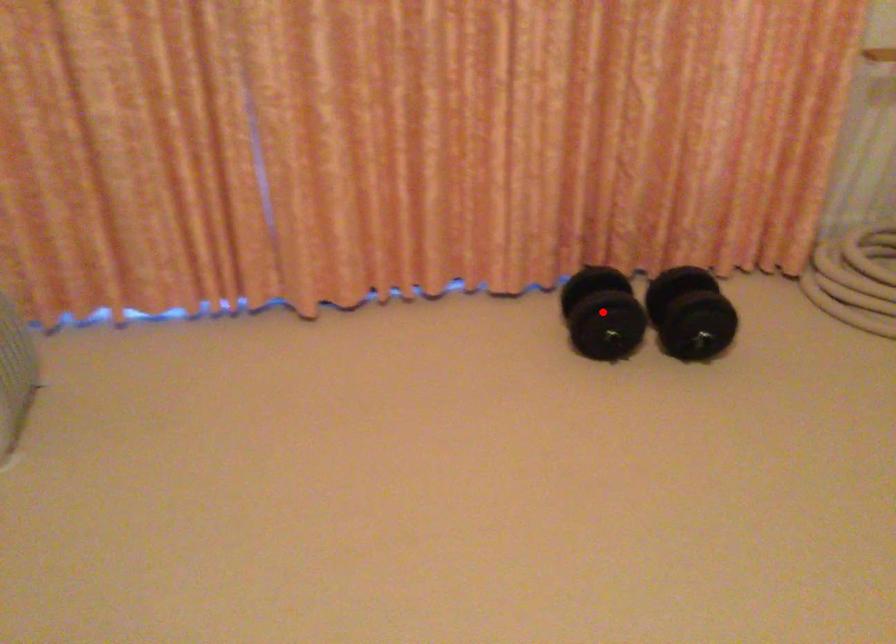
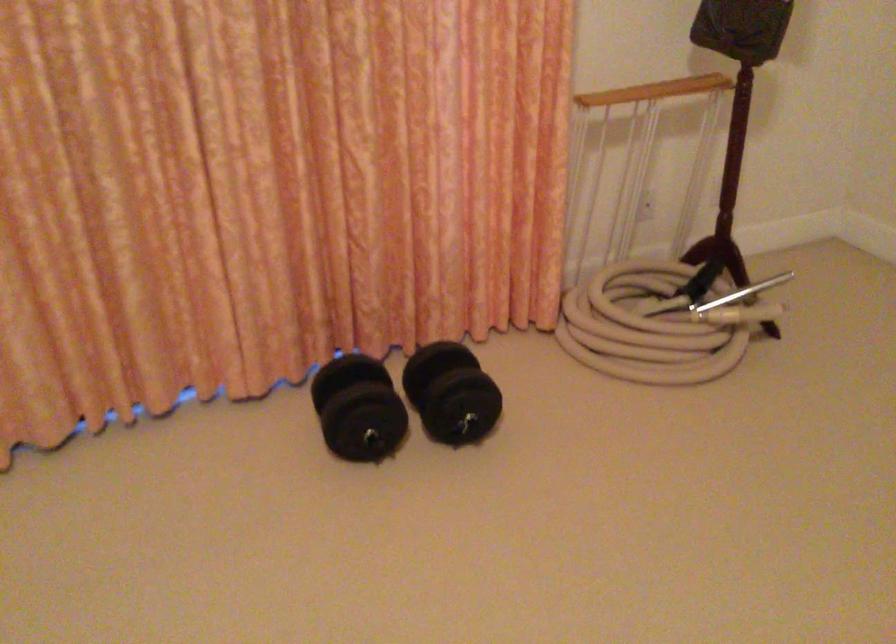
Question: I am providing you with two images of the same scene from different viewpoints. A red point is shown in image1. For the corresponding object point in image2, is it positioned nearer or farther from the camera?

Choices:
 (A) Nearer
 (B) Farther

Answer: (A)